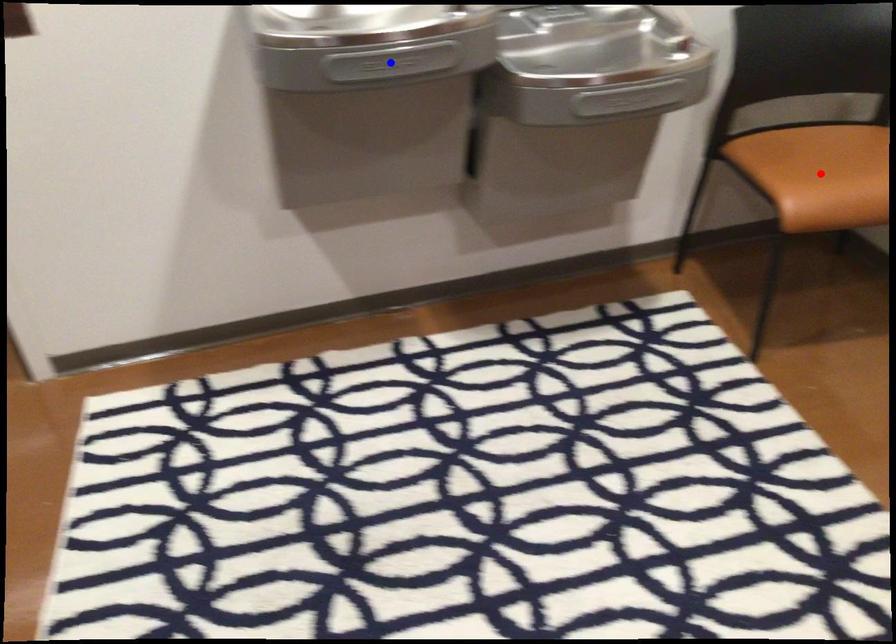
Question: Two points are marked on the image. Which point is closer to the camera?

Choices:
 (A) Blue point is closer.
 (B) Red point is closer.

Answer: (A)